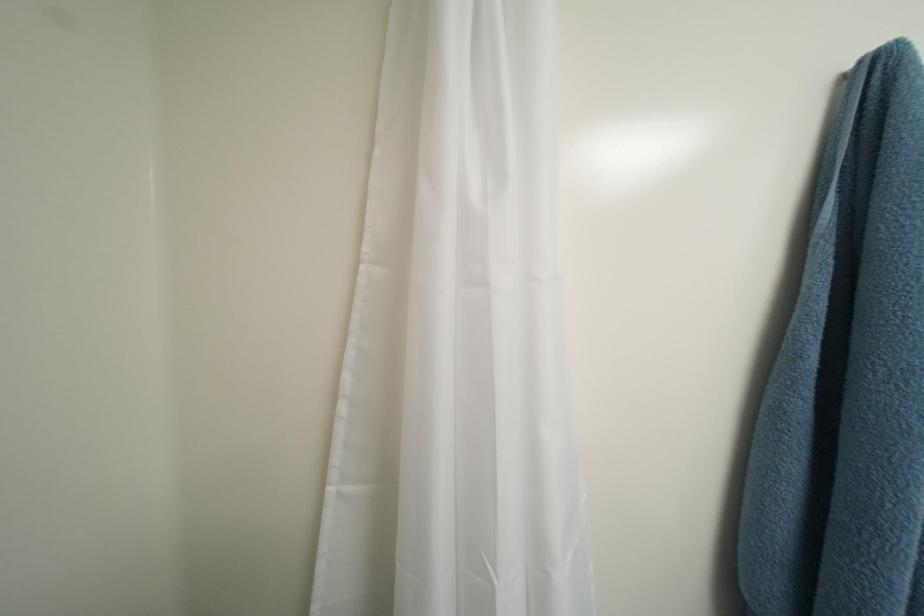
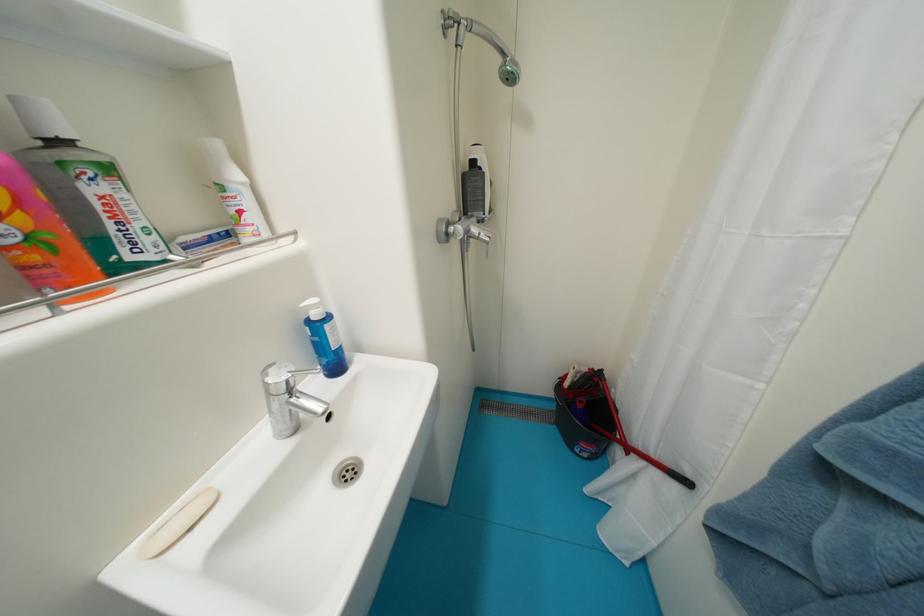
The first image is from the beginning of the video and the second image is from the end. How did the camera likely rotate when shooting the video?

The camera's rotation is toward left-down.